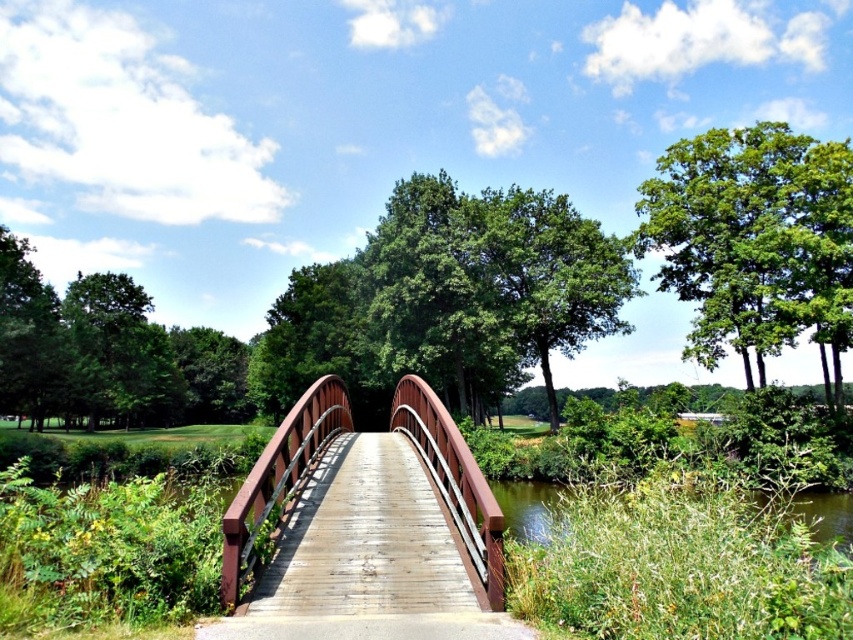
You are an architect designing a new pathway that needs to be wider than the wooden bridge at center. You observe the green leafy tree at upper right in the scene. Can the pathway be designed to be as wide as the tree?

The wooden bridge at center has a lesser width compared to green leafy tree at upper right. Therefore, the pathway can be designed to be as wide as the green leafy tree at upper right since it is wider than the bridge.

You are a bird flying over the wooden bridge at center and the green leafy tree at upper right. Which object is taller from your perspective?

The green leafy tree at upper right is taller than the wooden bridge at center.